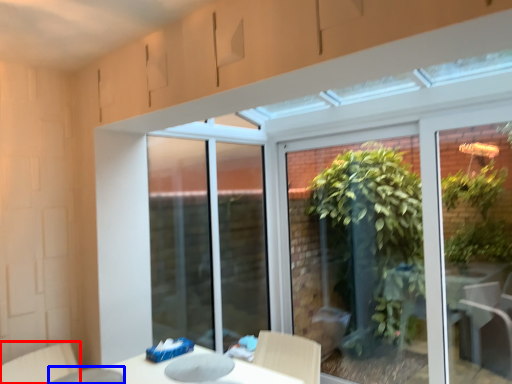
Question: Which object is further to the camera taking this photo, swivel chair (highlighted by a red box) or glass table (highlighted by a blue box)?

Choices:
 (A) swivel chair
 (B) glass table

Answer: (A)